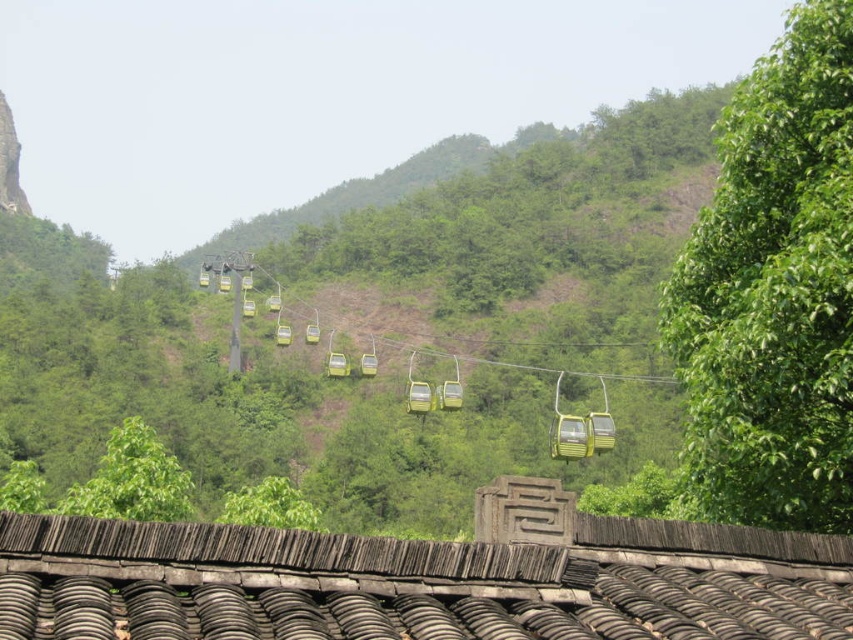
Question: In this image, where is green leafy tree at lower left located relative to yellow matte/glossy cable car at center?

Choices:
 (A) below
 (B) above

Answer: (A)

Question: Which of these objects is positioned farthest from the green leafy tree at center?

Choices:
 (A) yellow/green plastic lift at center
 (B) yellow matte/glossy cable car at center
 (C) green leafy tree at lower left
 (D) green leafy tree at right

Answer: (A)

Question: Observing the image, what is the correct spatial positioning of green leafy tree at right in reference to green leafy tree at lower left?

Choices:
 (A) left
 (B) right

Answer: (B)

Question: Which of the following is the closest to the observer?

Choices:
 (A) yellow matte/glossy cable car at center
 (B) green leafy tree at center
 (C) green leafy tree at lower left
 (D) green leafy tree at right

Answer: (D)

Question: Which point appears closest to the camera in this image?

Choices:
 (A) (254, 486)
 (B) (775, 237)
 (C) (248, 314)

Answer: (B)

Question: In this image, where is green leafy tree at right located relative to yellow/green plastic lift at center?

Choices:
 (A) above
 (B) below

Answer: (B)